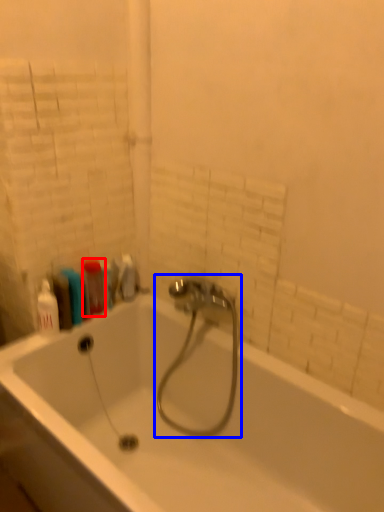
Question: Which of the following is the closest to the observer, cleaning product (highlighted by a red box) or tap (highlighted by a blue box)?

Choices:
 (A) cleaning product
 (B) tap

Answer: (B)